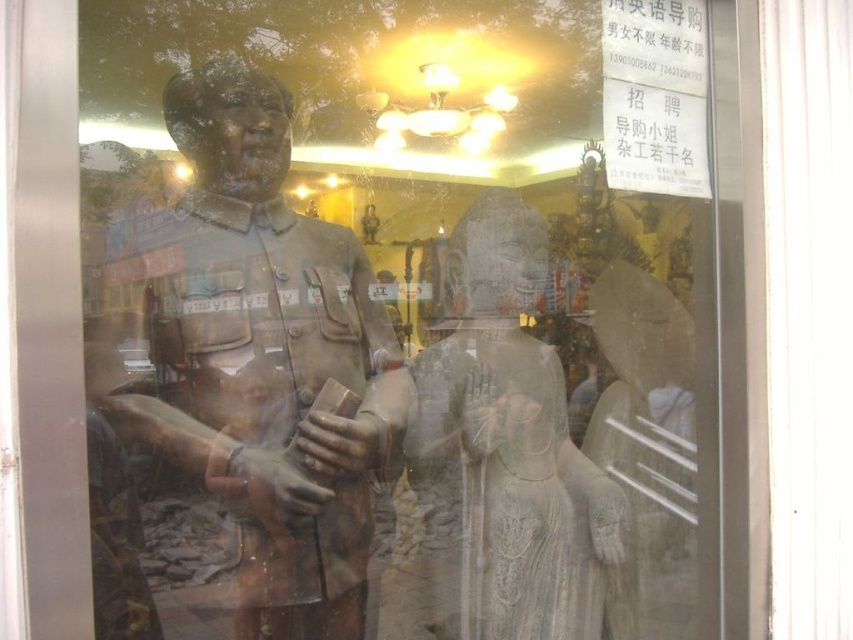
Does bronze statue at left have a lesser width compared to rusty stone statue at center?

In fact, bronze statue at left might be wider than rusty stone statue at center.

Based on the photo, is bronze statue at left positioned before rusty stone statue at center?

Yes.

Between point (248, 403) and point (451, 342), which one is positioned in front?

Point (248, 403) is in front.

Where is `bronze statue at left`? This screenshot has width=853, height=640. bronze statue at left is located at coordinates (241, 381).

Consider the image. Can you confirm if bronze statue at left is positioned below white marble statue at right?

Correct, bronze statue at left is located below white marble statue at right.

Based on the photo, which is below, bronze statue at left or white marble statue at right?

bronze statue at left is lower down.

Identify the location of bronze statue at left. (241, 381).

In order to click on bronze statue at left in this screenshot , I will do `click(241, 381)`.

Does rusty stone statue at center appear on the right side of white marble statue at right?

No, rusty stone statue at center is not to the right of white marble statue at right.

Does rusty stone statue at center have a lesser width compared to white marble statue at right?

In fact, rusty stone statue at center might be wider than white marble statue at right.

Which is behind, point (498, 497) or point (622, 582)?

The point (622, 582) is more distant.

Where is `rusty stone statue at center`? This screenshot has height=640, width=853. rusty stone statue at center is located at coordinates (x=497, y=461).